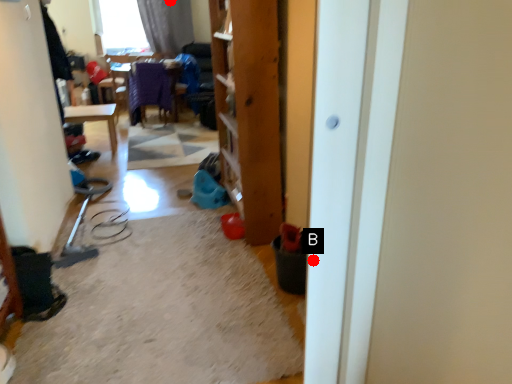
Question: Two points are circled on the image, labeled by A and B beside each circle. Which point is closer to the camera?

Choices:
 (A) A is closer
 (B) B is closer

Answer: (B)